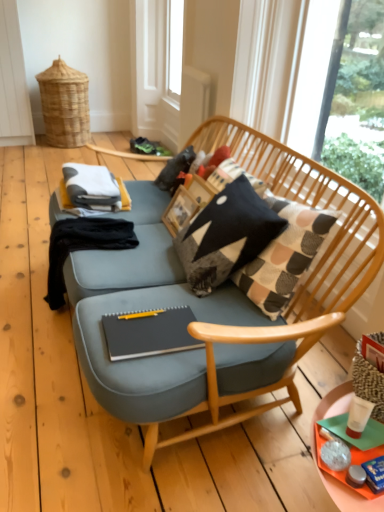
Question: From a real-world perspective, is transparent plastic screen door at upper center under knitted fabric pillow at center?

Choices:
 (A) no
 (B) yes

Answer: (A)

Question: Does transparent plastic screen door at upper center have a lesser height compared to knitted fabric pillow at center?

Choices:
 (A) no
 (B) yes

Answer: (A)

Question: Can you confirm if transparent plastic screen door at upper center is thinner than knitted fabric pillow at center?

Choices:
 (A) yes
 (B) no

Answer: (A)

Question: Does transparent plastic screen door at upper center have a greater width compared to knitted fabric pillow at center?

Choices:
 (A) no
 (B) yes

Answer: (A)

Question: Is transparent plastic screen door at upper center bigger than knitted fabric pillow at center?

Choices:
 (A) no
 (B) yes

Answer: (B)

Question: From the image's perspective, is transparent plastic screen door at upper center on knitted fabric pillow at center?

Choices:
 (A) yes
 (B) no

Answer: (A)

Question: From a real-world perspective, is transparent glass window at upper right below knitted fabric pillow at center?

Choices:
 (A) yes
 (B) no

Answer: (B)

Question: Is transparent glass window at upper right shorter than knitted fabric pillow at center?

Choices:
 (A) yes
 (B) no

Answer: (B)

Question: Does transparent glass window at upper right turn towards knitted fabric pillow at center?

Choices:
 (A) no
 (B) yes

Answer: (A)

Question: From a real-world perspective, is transparent glass window at upper right on top of knitted fabric pillow at center?

Choices:
 (A) yes
 (B) no

Answer: (A)

Question: Is the position of transparent glass window at upper right more distant than that of knitted fabric pillow at center?

Choices:
 (A) yes
 (B) no

Answer: (A)

Question: From the image's perspective, does transparent glass window at upper right appear higher than knitted fabric pillow at center?

Choices:
 (A) no
 (B) yes

Answer: (B)

Question: Is black fabric at left aimed at orange plastic tray at lower right?

Choices:
 (A) yes
 (B) no

Answer: (B)